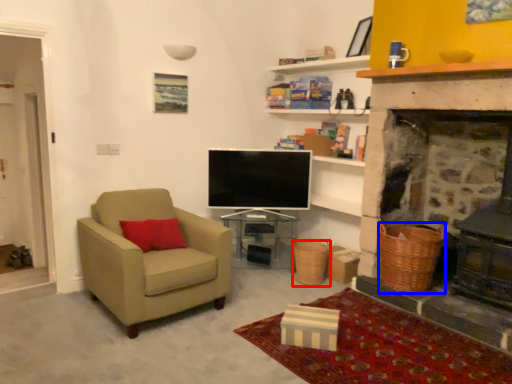
Question: Which object appears farthest to the camera in this image, basket (highlighted by a red box) or basket (highlighted by a blue box)?

Choices:
 (A) basket
 (B) basket

Answer: (A)